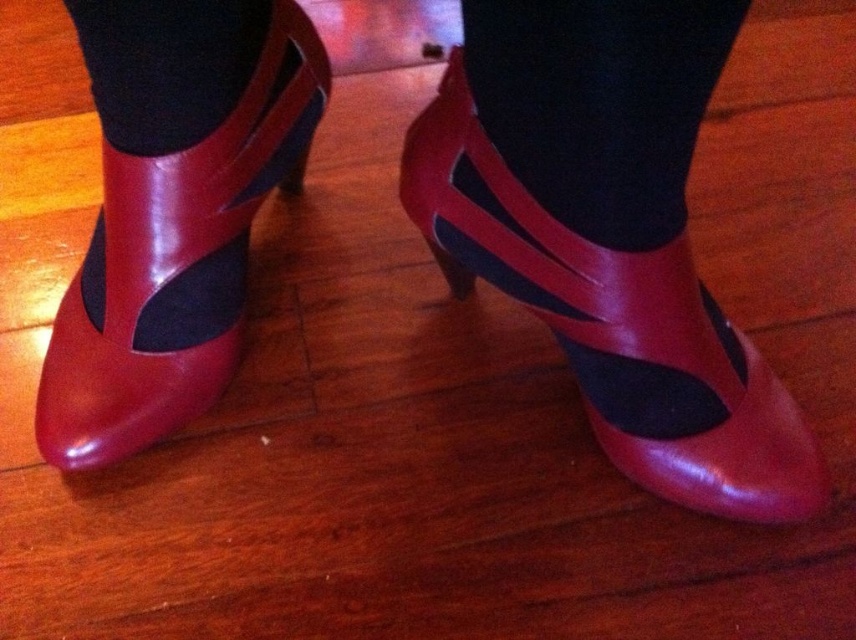
You are a photographer setting up a close shot of a shiny red leather shoe at center. The camera is positioned 30 inches away from the shoe. Will the camera be able to capture the entire shoe in the frame without moving closer?

The shiny red leather shoe at center is 34.21 inches from the viewer. Since the camera is set at 30 inches away, it is closer than the required distance. Moving the camera back to at least 34.21 inches would ensure the entire shoe fits in the frame.

You are trying to decide which sock to wear with your boots. You have two options in front of you on the floor. The black matte sock at center and the black smooth sock at upper left. Which sock reaches higher up your leg?

The black matte sock at center reaches higher up the leg compared to the black smooth sock at upper left because it has a greater height.